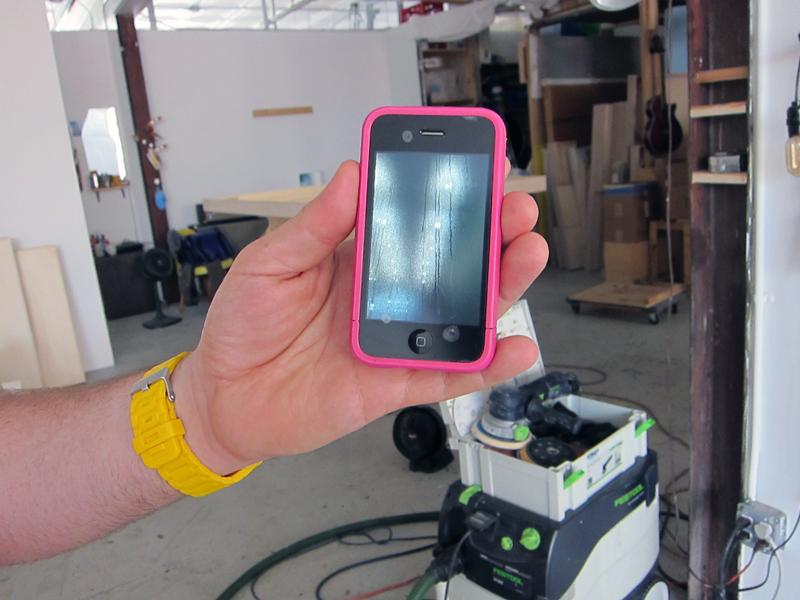
Find the location of `rolling cart`. rolling cart is located at coordinates (633, 299).